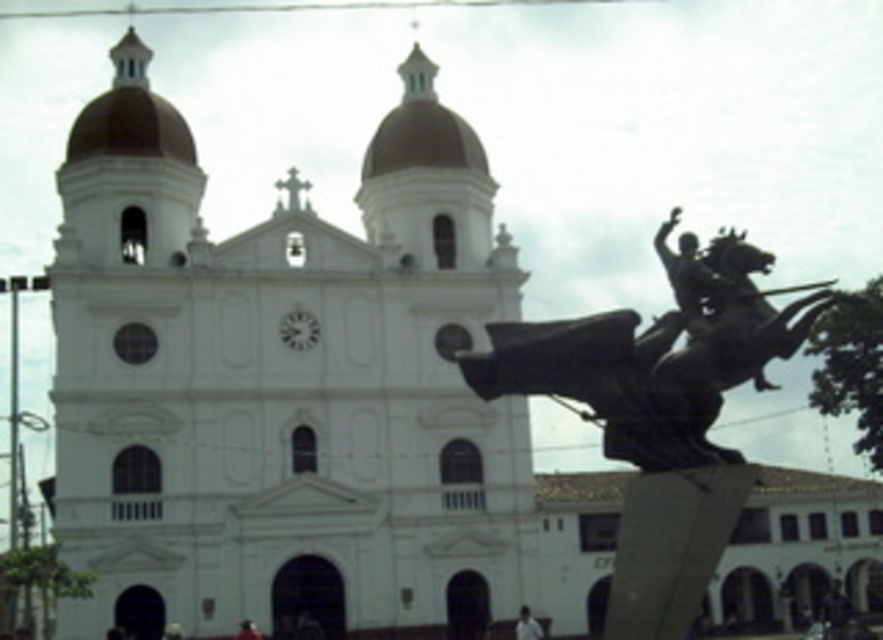
Is bronze statue at center above smooth red shirt at lower left?

Indeed, bronze statue at center is positioned over smooth red shirt at lower left.

Can you confirm if bronze statue at center is positioned below smooth red shirt at lower left?

Incorrect, bronze statue at center is not positioned below smooth red shirt at lower left.

What do you see at coordinates (658, 355) in the screenshot? This screenshot has height=640, width=883. I see `bronze statue at center` at bounding box center [658, 355].

Find the location of a particular element. bronze statue at center is located at coordinates (658, 355).

Is bronze statue at center taller than white matte person at lower center?

Yes.

Measure the distance between bronze statue at center and white matte person at lower center.

bronze statue at center is 33.25 meters away from white matte person at lower center.

Describe the element at coordinates (658, 355) in the screenshot. I see `bronze statue at center` at that location.

The image size is (883, 640). What are the coordinates of `bronze statue at center` in the screenshot? It's located at (658, 355).

Is white matte person at lower center positioned before smooth red shirt at lower left?

That is False.

Is white matte person at lower center behind smooth red shirt at lower left?

Yes, it is behind smooth red shirt at lower left.

Between point (529, 634) and point (232, 637), which one is positioned behind?

Point (529, 634)

At what (x,y) coordinates should I click in order to perform the action: click on white matte person at lower center. Please return your answer as a coordinate pair (x, y). The height and width of the screenshot is (640, 883). Looking at the image, I should click on (527, 625).